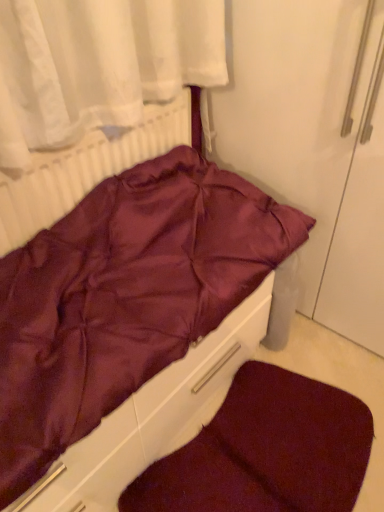
Question: From their relative heights in the image, would you say burgundy satin bed at center is taller or shorter than burgundy plush dog bed at lower center?

Choices:
 (A) tall
 (B) short

Answer: (A)

Question: Visually, is burgundy satin bed at center positioned to the left or to the right of burgundy plush dog bed at lower center?

Choices:
 (A) left
 (B) right

Answer: (A)

Question: Estimate the real-world distances between objects in this image. Which object is closer to the burgundy satin bed at center?

Choices:
 (A) burgundy plush dog bed at lower center
 (B) white textured radiator at upper left

Answer: (B)

Question: Which object is the closest to the white textured radiator at upper left?

Choices:
 (A) burgundy satin bed at center
 (B) burgundy plush dog bed at lower center

Answer: (A)